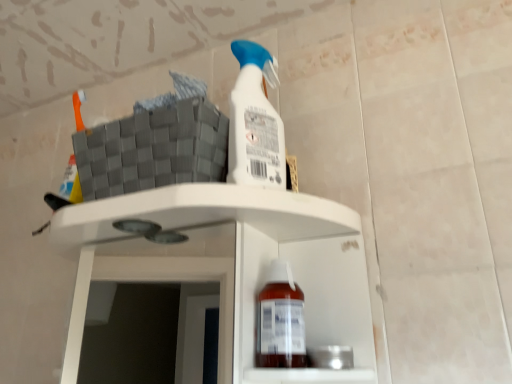
Identify the location of white matte shelf at center. This screenshot has width=512, height=384. (231, 266).

Describe the element at coordinates (231, 266) in the screenshot. I see `white matte shelf at center` at that location.

Describe the element at coordinates (280, 320) in the screenshot. I see `translucent plastic bottle at lower center` at that location.

The image size is (512, 384). What are the coordinates of `translucent plastic bottle at lower center` in the screenshot? It's located at (280, 320).

Where is `white matte shelf at center`? This screenshot has height=384, width=512. white matte shelf at center is located at coordinates (231, 266).

Which is more to the right, translucent plastic bottle at lower center or white matte shelf at center?

From the viewer's perspective, translucent plastic bottle at lower center appears more on the right side.

Which object is closer to the camera taking this photo, translucent plastic bottle at lower center or white matte shelf at center?

white matte shelf at center is in front.

Is point (261, 337) behind point (168, 205)?

Yes, it is behind point (168, 205).

From the image's perspective, which object appears higher, translucent plastic bottle at lower center or white matte shelf at center?

translucent plastic bottle at lower center, from the image's perspective.

From a real-world perspective, is translucent plastic bottle at lower center positioned under white matte shelf at center based on gravity?

Yes.

In terms of width, does translucent plastic bottle at lower center look wider or thinner when compared to white matte shelf at center?

Clearly, translucent plastic bottle at lower center has less width compared to white matte shelf at center.

Between translucent plastic bottle at lower center and white matte shelf at center, which one has less height?

translucent plastic bottle at lower center.

Is translucent plastic bottle at lower center bigger or smaller than white matte shelf at center?

Considering their sizes, translucent plastic bottle at lower center takes up less space than white matte shelf at center.

Would you say white matte shelf at center is part of translucent plastic bottle at lower center's contents?

No, translucent plastic bottle at lower center does not contain white matte shelf at center.

Are translucent plastic bottle at lower center and white matte shelf at center making contact?

translucent plastic bottle at lower center is not next to white matte shelf at center, and they're not touching.

Is translucent plastic bottle at lower center turned away from white matte shelf at center?

Absolutely, translucent plastic bottle at lower center is directed away from white matte shelf at center.

How different are the orientations of translucent plastic bottle at lower center and white matte shelf at center in degrees?

The angular difference between translucent plastic bottle at lower center and white matte shelf at center is 0.000164 degrees.

Locate an element on the screen. shelf above the translucent plastic bottle at lower center (from a real-world perspective) is located at coordinates (231, 266).

Considering the relative positions of white matte shelf at center and translucent plastic bottle at lower center in the image provided, is white matte shelf at center to the right of translucent plastic bottle at lower center from the viewer's perspective?

In fact, white matte shelf at center is to the left of translucent plastic bottle at lower center.

Is the position of white matte shelf at center more distant than that of translucent plastic bottle at lower center?

No, the depth of white matte shelf at center is less than that of translucent plastic bottle at lower center.

Is point (303, 275) less distant than point (302, 363)?

No, it is not.

From the image's perspective, between white matte shelf at center and translucent plastic bottle at lower center, which one is located above?

translucent plastic bottle at lower center is shown above in the image.

From a real-world perspective, is white matte shelf at center on top of translucent plastic bottle at lower center?

Yes, from a real-world perspective, white matte shelf at center is above translucent plastic bottle at lower center.

Which object is wider, white matte shelf at center or translucent plastic bottle at lower center?

white matte shelf at center is wider.

Considering the relative sizes of white matte shelf at center and translucent plastic bottle at lower center in the image provided, is white matte shelf at center taller than translucent plastic bottle at lower center?

Yes, white matte shelf at center is taller than translucent plastic bottle at lower center.

Considering the relative sizes of white matte shelf at center and translucent plastic bottle at lower center in the image provided, is white matte shelf at center smaller than translucent plastic bottle at lower center?

Incorrect, white matte shelf at center is not smaller in size than translucent plastic bottle at lower center.

Does white matte shelf at center contain translucent plastic bottle at lower center?

Absolutely, translucent plastic bottle at lower center is inside white matte shelf at center.

Is white matte shelf at center directly adjacent to translucent plastic bottle at lower center?

white matte shelf at center and translucent plastic bottle at lower center are not in contact.

Is white matte shelf at center facing away from translucent plastic bottle at lower center?

Yes, white matte shelf at center is facing away from translucent plastic bottle at lower center.

Can you tell me how much white matte shelf at center and translucent plastic bottle at lower center differ in facing direction?

They differ by 0.000164 degrees in their facing directions.

In the scene shown: Measure the distance between white matte shelf at center and translucent plastic bottle at lower center.

white matte shelf at center and translucent plastic bottle at lower center are 1.03 meters apart.

At what (x,y) coordinates should I click in order to perform the action: click on bottle below the white matte shelf at center (from a real-world perspective). Please return your answer as a coordinate pair (x, y). The image size is (512, 384). Looking at the image, I should click on (280, 320).

I want to click on shelf below the translucent plastic bottle at lower center (from the image's perspective), so click(231, 266).

Where is `shelf above the translucent plastic bottle at lower center (from a real-world perspective)`? This screenshot has height=384, width=512. shelf above the translucent plastic bottle at lower center (from a real-world perspective) is located at coordinates (231, 266).